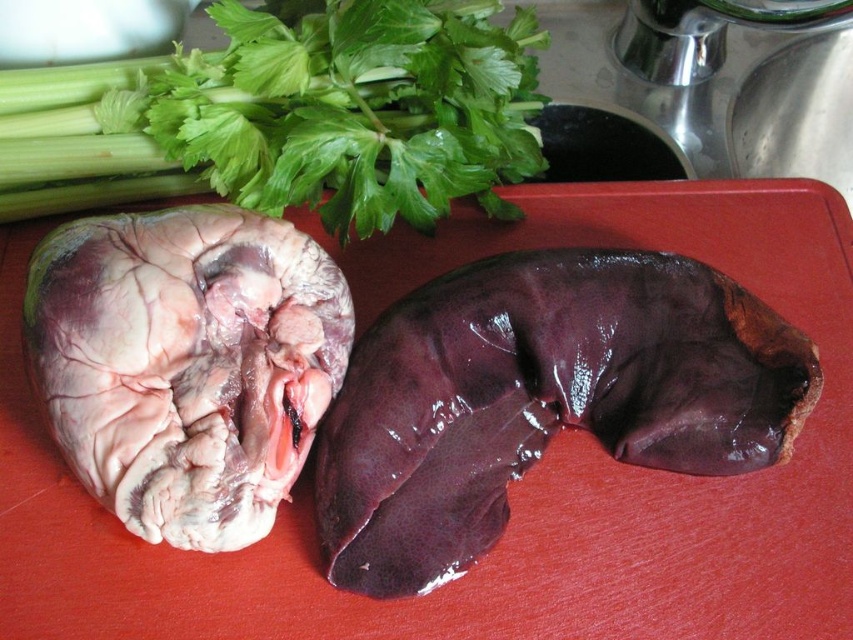
Question: Which point is farther to the camera?

Choices:
 (A) pinkish white flesh at center
 (B) green leafy vegetable at upper left
 (C) dark purple glossy liver at center

Answer: (B)

Question: Is dark purple glossy liver at center closer to the viewer compared to pinkish white flesh at center?

Choices:
 (A) yes
 (B) no

Answer: (B)

Question: Among these points, which one is farthest from the camera?

Choices:
 (A) (178, 544)
 (B) (376, 513)
 (C) (431, 81)

Answer: (C)

Question: Among these points, which one is farthest from the camera?

Choices:
 (A) (160, 364)
 (B) (509, 77)

Answer: (B)

Question: In this image, where is dark purple glossy liver at center located relative to pinkish white flesh at center?

Choices:
 (A) above
 (B) below

Answer: (B)

Question: Does dark purple glossy liver at center appear under green leafy vegetable at upper left?

Choices:
 (A) yes
 (B) no

Answer: (A)